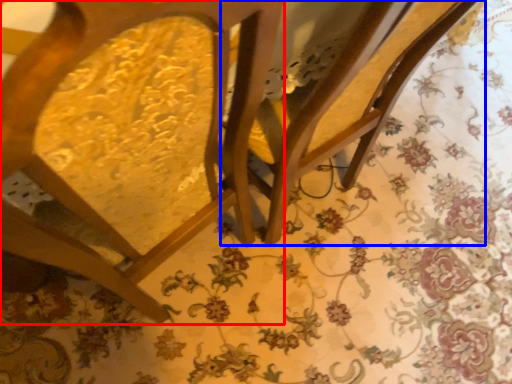
Question: Which object appears farthest to the camera in this image, chair (highlighted by a red box) or swivel chair (highlighted by a blue box)?

Choices:
 (A) chair
 (B) swivel chair

Answer: (B)